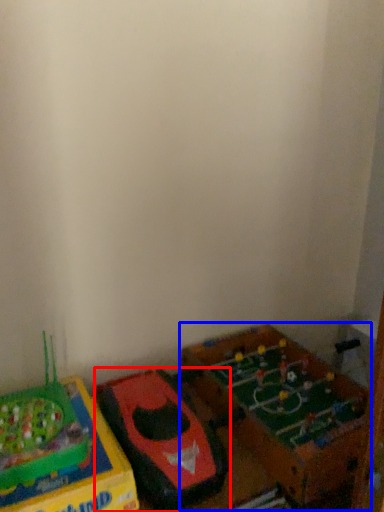
Question: Which object is closer to the camera taking this photo, toy (highlighted by a red box) or toy (highlighted by a blue box)?

Choices:
 (A) toy
 (B) toy

Answer: (A)